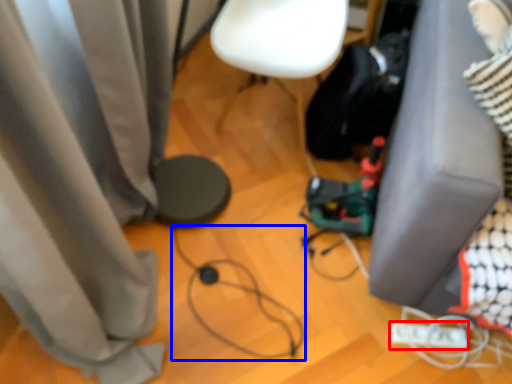
Question: Which object appears farthest to the camera in this image, Wii controller (highlighted by a red box) or wire (highlighted by a blue box)?

Choices:
 (A) Wii controller
 (B) wire

Answer: (A)